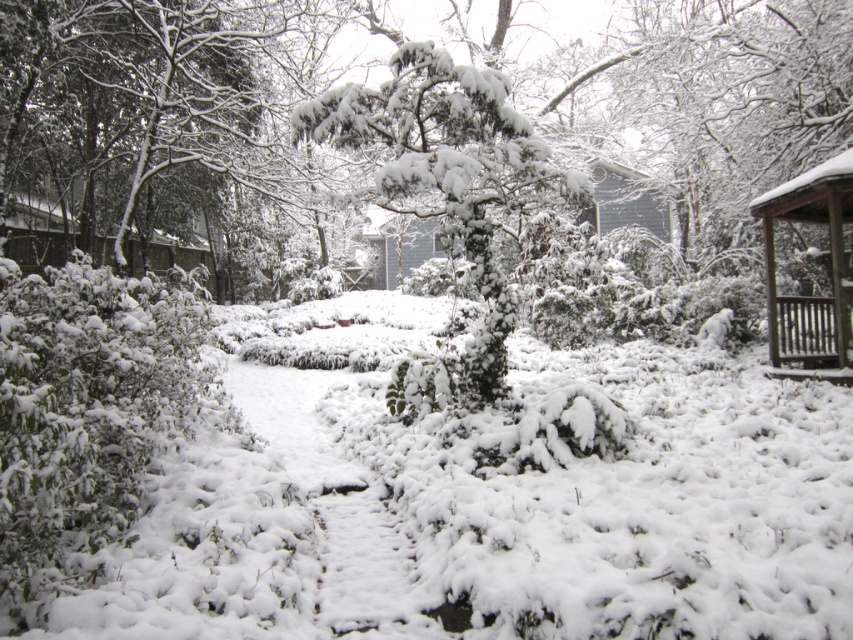
Which is above, snow-covered evergreen at center or wooden gazebo at right?

Positioned higher is snow-covered evergreen at center.

Does snow-covered evergreen at center have a lesser width compared to wooden gazebo at right?

In fact, snow-covered evergreen at center might be wider than wooden gazebo at right.

Is point (490, 182) in front of point (845, 332)?

Yes, it is in front of point (845, 332).

Where is `snow-covered evergreen at center`? The width and height of the screenshot is (853, 640). snow-covered evergreen at center is located at coordinates (448, 168).